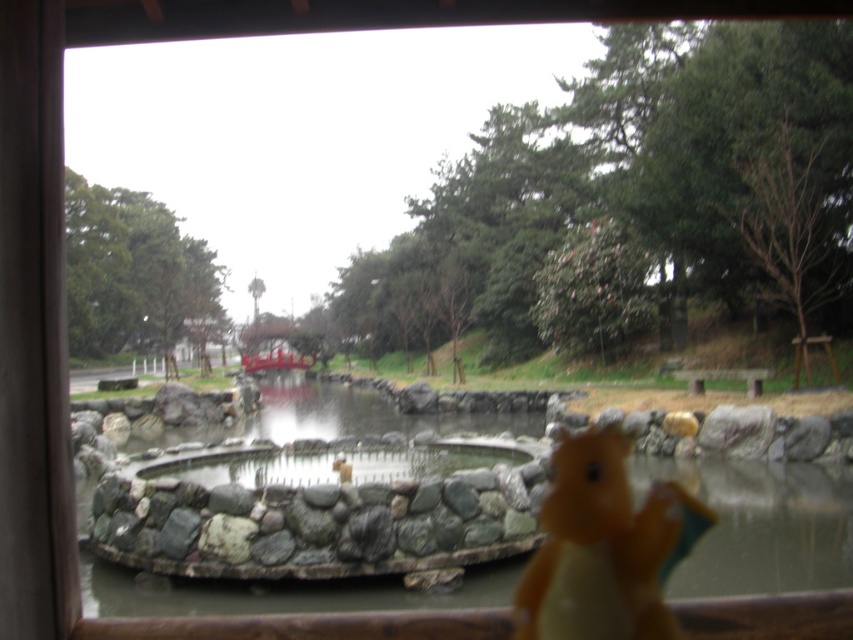
Question: Is smooth stone pond at center above yellow rubber duck at lower right?

Choices:
 (A) yes
 (B) no

Answer: (B)

Question: Which object appears farthest from the camera in this image?

Choices:
 (A) yellow rubber duck at lower right
 (B) smooth stone pond at center

Answer: (B)

Question: Can you confirm if smooth stone pond at center is wider than yellow rubber duck at lower right?

Choices:
 (A) no
 (B) yes

Answer: (B)

Question: Which of the following is the closest to the observer?

Choices:
 (A) (630, 448)
 (B) (845, 586)

Answer: (B)

Question: Is smooth stone pond at center bigger than yellow rubber duck at lower right?

Choices:
 (A) no
 (B) yes

Answer: (B)

Question: Which point is farther from the camera taking this photo?

Choices:
 (A) coord(622,538)
 (B) coord(229,474)

Answer: (B)